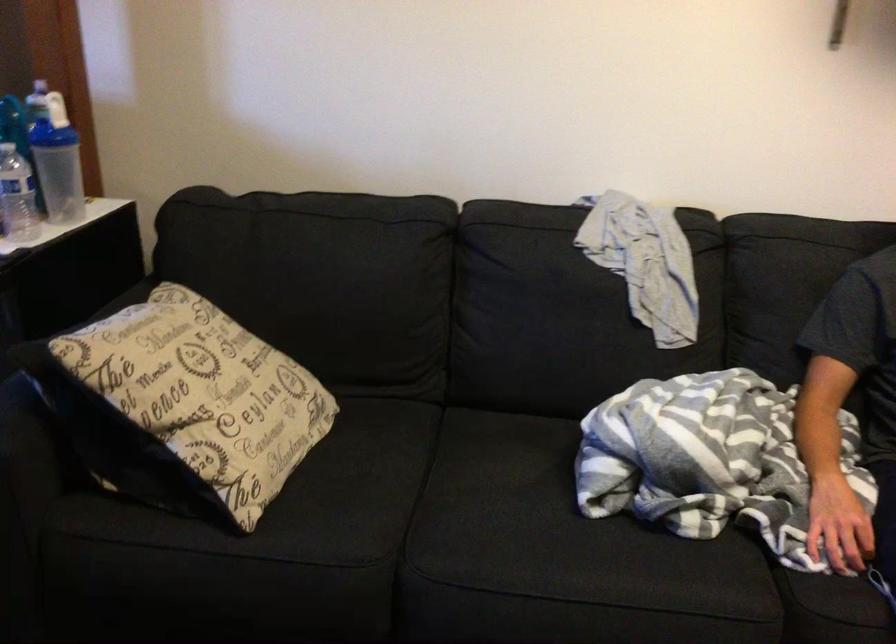
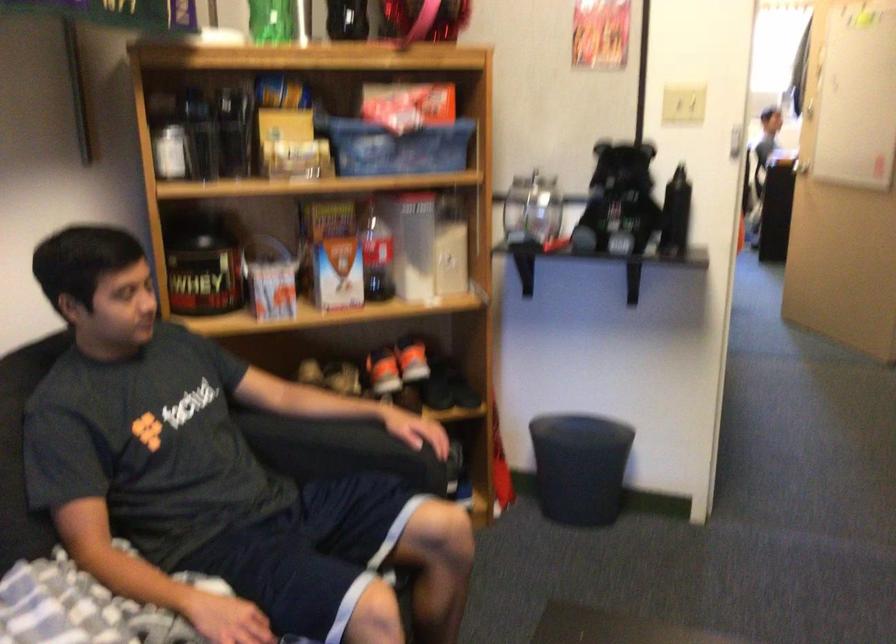
Question: The camera is either moving clockwise (left) or counter-clockwise (right) around the object. The first image is from the beginning of the video and the second image is from the end. Is the camera moving left or right when shooting the video?

Choices:
 (A) Left
 (B) Right

Answer: (A)